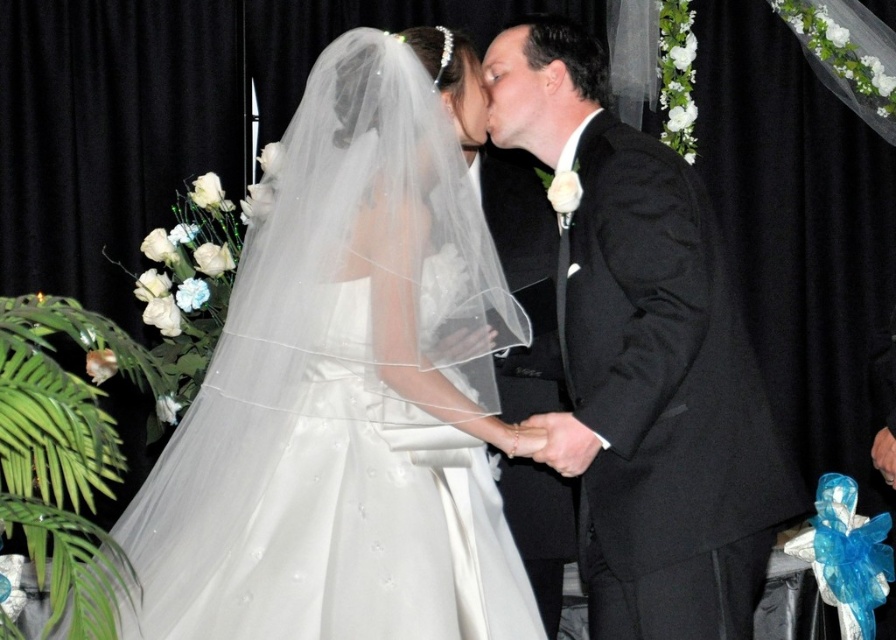
Who is higher up, satin white dress at center or black satin suit at center?

Positioned higher is black satin suit at center.

The width and height of the screenshot is (896, 640). What do you see at coordinates (349, 385) in the screenshot?
I see `satin white dress at center` at bounding box center [349, 385].

Does point (506, 452) lie behind point (602, 604)?

That is False.

Where is `satin white dress at center`? satin white dress at center is located at coordinates (349, 385).